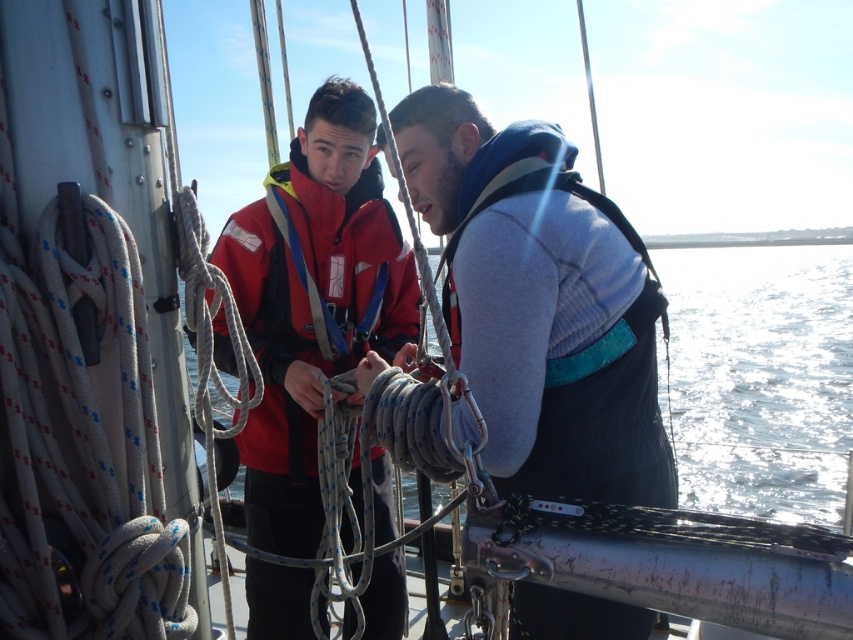
You are a sailor on a boat and need to locate your gray fleece sweater at center and matte red life jacket at center. According to the scene, which item is positioned to the right of the other?

The gray fleece sweater at center is to the right of the matte red life jacket at center.

You are a sailor trying to secure a rope. You need to determine which item is taller between the gray fleece sweater at center and the matte red life jacket at center to decide where to place your gear. Which one is taller?

The gray fleece sweater at center is much taller than the matte red life jacket at center, so you should place your gear accordingly.

You are standing on the deck of the sailing vessel and want to reach the point closer to you between the two points marked as point (570, 275) and point (351, 298). Which point should you move towards?

You should move towards point (570, 275) because it is closer to the viewer than point (351, 298).